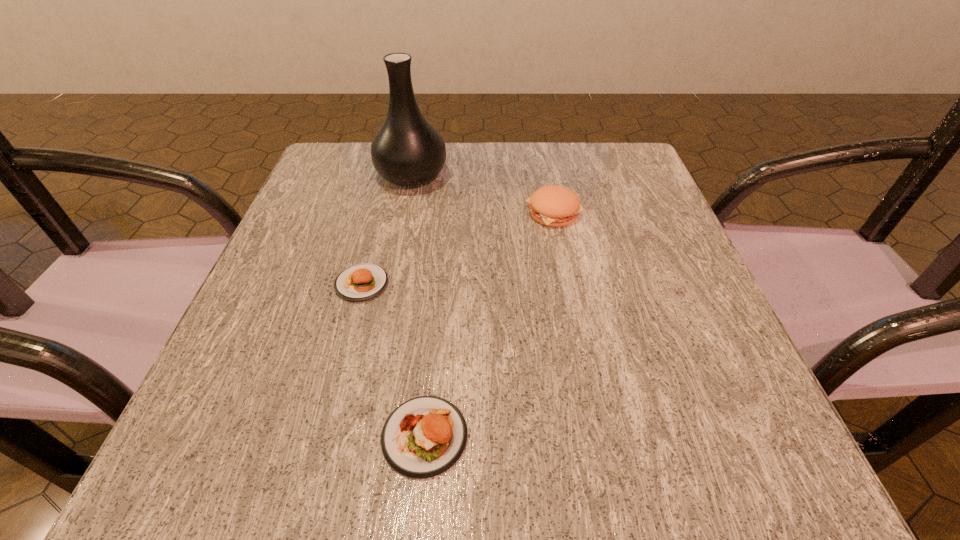
You are a GUI agent. You are given a task and a screenshot of the screen. Output one action in this format:
    pyautogui.click(x=<x>, y=<y>)
    Task: Click on the free region located on the right of the second food from right to left
    This screenshot has width=960, height=540.
    Given the screenshot: What is the action you would take?
    pyautogui.click(x=578, y=436)

The width and height of the screenshot is (960, 540). I want to click on vacant space situated 0.150m on the back of the leftmost food, so click(x=380, y=214).

Locate an element on the screen. vase positioned at the far edge is located at coordinates pyautogui.click(x=407, y=150).

In order to click on patty that is at the far edge in this screenshot , I will do click(555, 206).

I want to click on object that is at the near edge, so [x=425, y=436].

At what (x,y) coordinates should I click in order to perform the action: click on vase that is at the left edge. Please return your answer as a coordinate pair (x, y). The width and height of the screenshot is (960, 540). Looking at the image, I should click on (407, 150).

The image size is (960, 540). Identify the location of food that is at the left edge. (360, 282).

Where is `object at the far left corner`? The image size is (960, 540). object at the far left corner is located at coordinates (407, 150).

Locate an element on the screen. This screenshot has width=960, height=540. vacant space at the far edge of the desktop is located at coordinates (425, 199).

Image resolution: width=960 pixels, height=540 pixels. Identify the location of free spot at the near edge of the desktop. (380, 422).